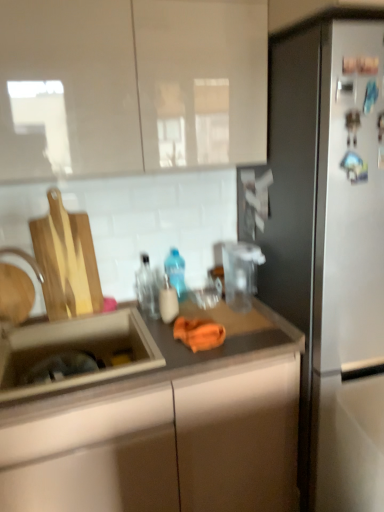
Identify the location of vacant region to the right of transparent glass bottle at center, which is the second bottle from front to back. This screenshot has width=384, height=512. coord(195,310).